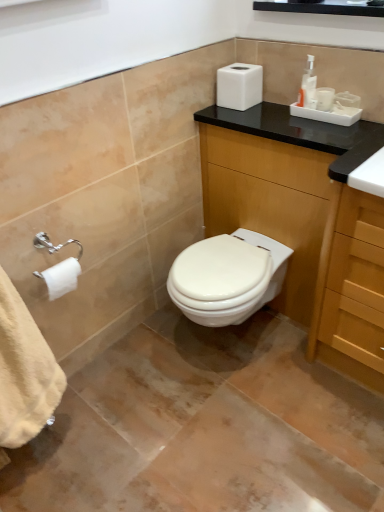
Question: Is the position of white matte toilet paper at left more distant than that of black glossy medicine cabinet at upper center?

Choices:
 (A) yes
 (B) no

Answer: (A)

Question: Is white matte toilet paper at left beside black glossy medicine cabinet at upper center?

Choices:
 (A) no
 (B) yes

Answer: (A)

Question: Is white matte toilet paper at left aimed at black glossy medicine cabinet at upper center?

Choices:
 (A) no
 (B) yes

Answer: (A)

Question: Does white matte toilet paper at left appear on the left side of black glossy medicine cabinet at upper center?

Choices:
 (A) yes
 (B) no

Answer: (A)

Question: Does white matte toilet paper at left have a smaller size compared to black glossy medicine cabinet at upper center?

Choices:
 (A) yes
 (B) no

Answer: (A)

Question: Is point (309, 99) closer or farther from the camera than point (327, 122)?

Choices:
 (A) closer
 (B) farther

Answer: (B)

Question: In the image, is translucent plastic pump bottle at upper right on the left side or the right side of wooden cabinet at center?

Choices:
 (A) left
 (B) right

Answer: (B)

Question: From a real-world perspective, is translucent plastic pump bottle at upper right positioned above or below wooden cabinet at center?

Choices:
 (A) below
 (B) above

Answer: (B)

Question: Is translucent plastic pump bottle at upper right wider or thinner than wooden cabinet at center?

Choices:
 (A) wide
 (B) thin

Answer: (B)

Question: Is black glossy medicine cabinet at upper center inside or outside of white matte toilet paper at left?

Choices:
 (A) inside
 (B) outside

Answer: (B)

Question: Would you say black glossy medicine cabinet at upper center is to the left or to the right of white matte toilet paper at left in the picture?

Choices:
 (A) right
 (B) left

Answer: (A)

Question: From a real-world perspective, is black glossy medicine cabinet at upper center positioned above or below white matte toilet paper at left?

Choices:
 (A) above
 (B) below

Answer: (A)

Question: Is point (311, 2) positioned closer to the camera than point (74, 279)?

Choices:
 (A) closer
 (B) farther

Answer: (A)

Question: Considering the positions of wooden cabinet at center and white matte toilet paper at left in the image, is wooden cabinet at center taller or shorter than white matte toilet paper at left?

Choices:
 (A) tall
 (B) short

Answer: (A)

Question: Visually, is wooden cabinet at center positioned to the left or to the right of white matte toilet paper at left?

Choices:
 (A) left
 (B) right

Answer: (B)